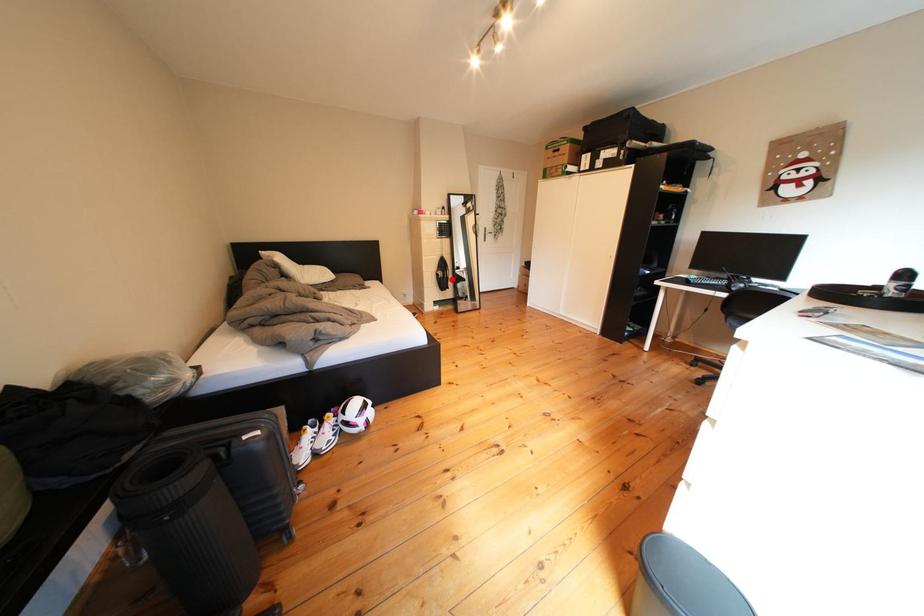
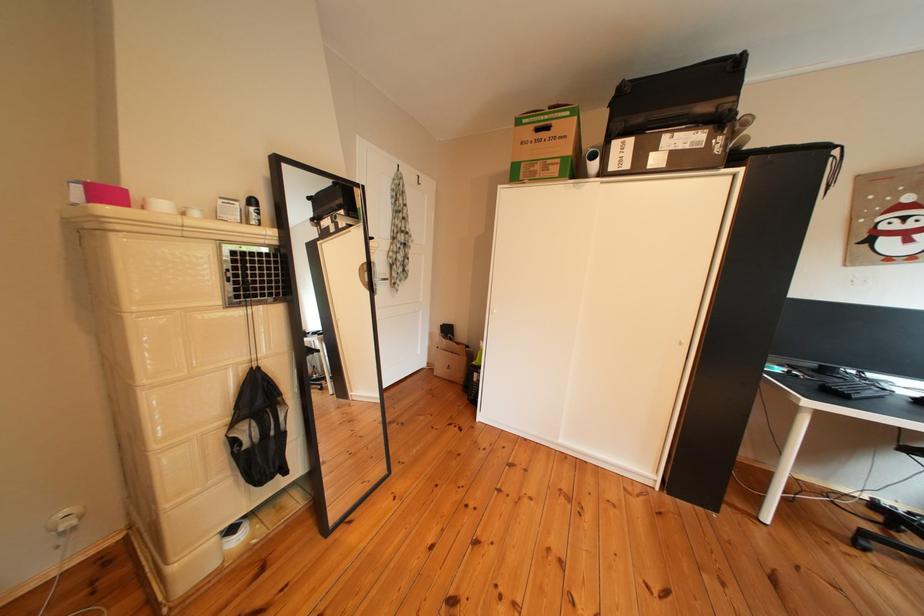
Find the pixel in the second image that matches the highlighted location in the first image.

(249, 447)